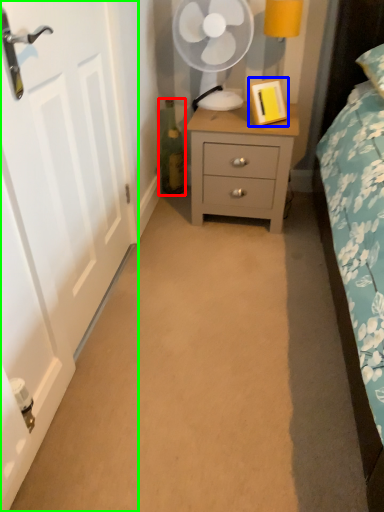
Question: Which object is the closest to the bottle (highlighted by a red box)? Choose among these: picture frame (highlighted by a blue box) or door (highlighted by a green box).

Choices:
 (A) picture frame
 (B) door

Answer: (A)